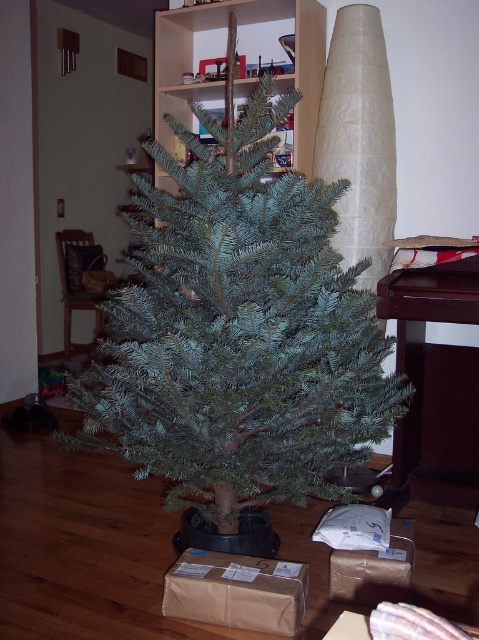
You are a delivery person who just arrived at the house with a new gift. You see the green matte christmas tree at center and the brown cardboard box at lower center. Which object is closer to you?

The green matte christmas tree at center is closer to you because it is in front of the brown cardboard box at lower center.

You are standing at the origin of the coordinate system in the image. You want to place a new gift at the point marked by point (237, 592). Is there already an object at that location?

Yes, there is already a brown paper box at center at point (237, 592).

You are standing in front of the Christmas tree and want to place a decoration at point (x=178, y=432) and another decoration at point (x=298, y=572). Which decoration will be closer to you?

The decoration placed at point (x=178, y=432) will be closer to you because it is closer to the viewer than point (x=298, y=572).